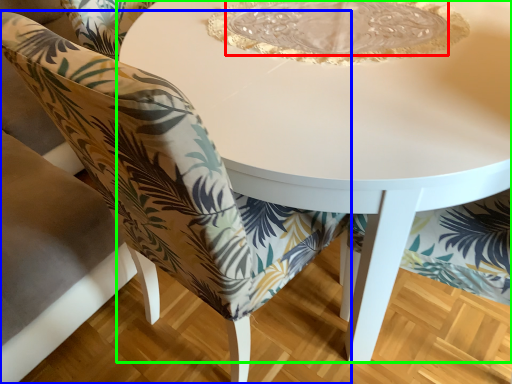
Question: Estimate the real-world distances between objects in this image. Which object is farther from glass plate (highlighted by a red box), chair (highlighted by a blue box) or table (highlighted by a green box)?

Choices:
 (A) chair
 (B) table

Answer: (A)